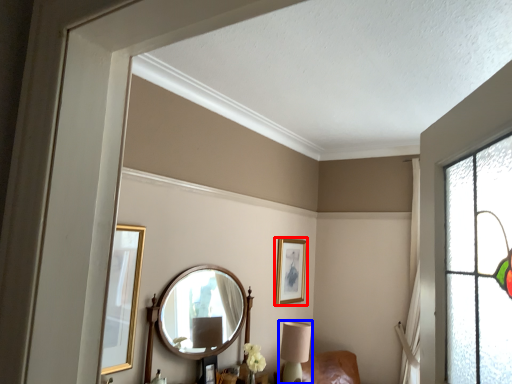
Question: Which of the following is the farthest to the observer, picture frame (highlighted by a red box) or table lamp (highlighted by a blue box)?

Choices:
 (A) picture frame
 (B) table lamp

Answer: (A)